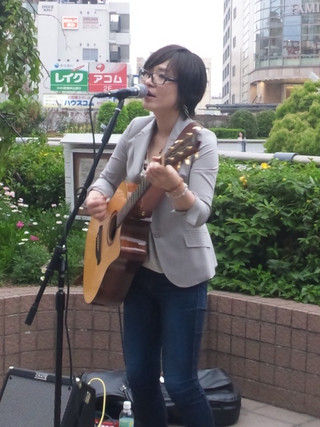
Find the location of a particular element. This screenshot has height=427, width=320. brick wall is located at coordinates (255, 356), (20, 347).